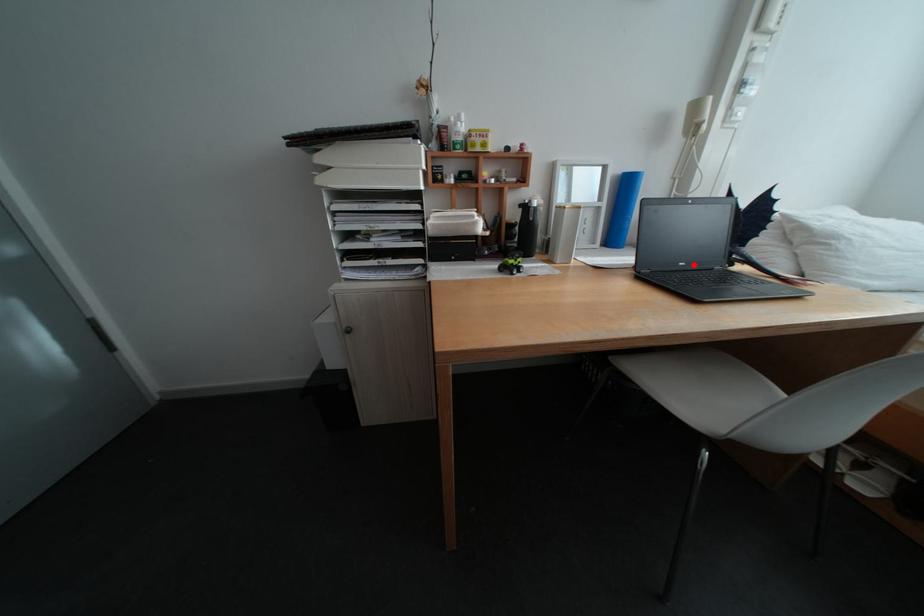
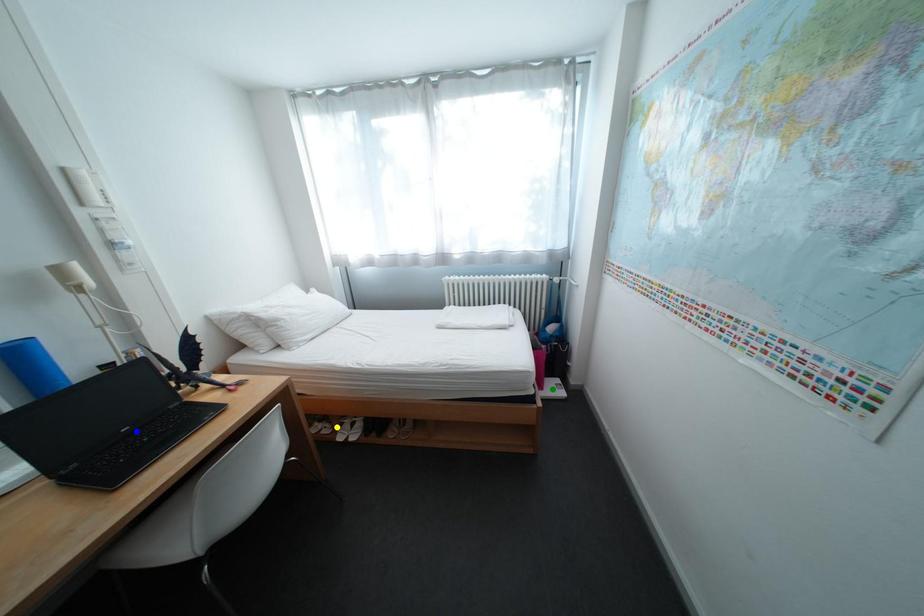
Question: I am providing you with two images of the same scene from different viewpoints. A red point is marked on the first image. You are given multiple points on the second image. In image 2, which mark is for the same physical point as the one in image 1?

Choices:
 (A) yellow point
 (B) green point
 (C) blue point

Answer: (C)